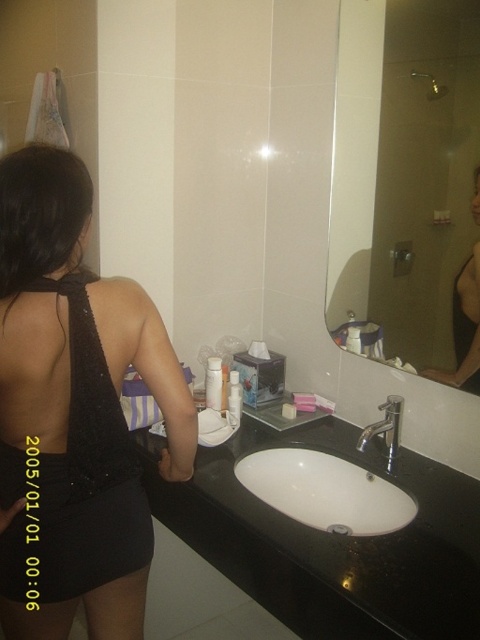
Is glossy glass mirror at upper right shorter than white plastic container at center?

No.

Image resolution: width=480 pixels, height=640 pixels. I want to click on glossy glass mirror at upper right, so click(408, 182).

You are a GUI agent. You are given a task and a screenshot of the screen. Output one action in this format:
    pyautogui.click(x=<x>, y=<y>)
    Task: Click on the glossy glass mirror at upper right
    This screenshot has height=640, width=480.
    Given the screenshot: What is the action you would take?
    (x=408, y=182)

Which is more to the right, white glossy sink at center or matte black tank top at upper center?

Positioned to the right is matte black tank top at upper center.

Who is positioned more to the left, white glossy sink at center or matte black tank top at upper center?

white glossy sink at center is more to the left.

You are a GUI agent. You are given a task and a screenshot of the screen. Output one action in this format:
    pyautogui.click(x=<x>, y=<y>)
    Task: Click on the white glossy sink at center
    
    Given the screenshot: What is the action you would take?
    pyautogui.click(x=325, y=492)

Is the position of black sequined dress at left less distant than that of silver metallic faucet at center?

That is True.

From the picture: Which is below, black sequined dress at left or silver metallic faucet at center?

silver metallic faucet at center

At what (x,y) coordinates should I click in order to perform the action: click on black sequined dress at left. Please return your answer as a coordinate pair (x, y). This screenshot has height=640, width=480. Looking at the image, I should click on (73, 412).